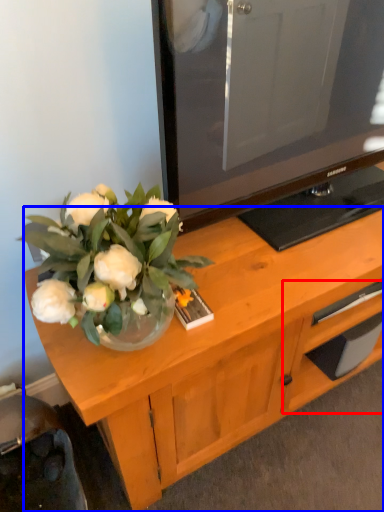
Question: Which point is closer to the camera, drawer (highlighted by a red box) or desk (highlighted by a blue box)?

Choices:
 (A) drawer
 (B) desk

Answer: (B)